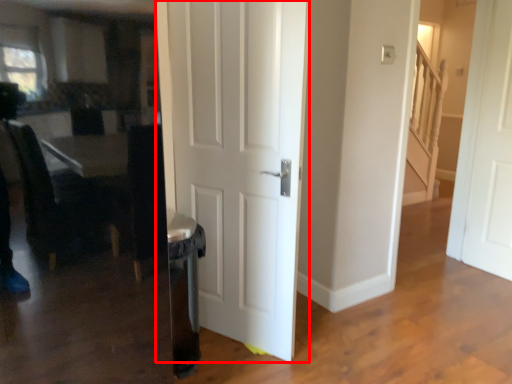
Question: Considering the relative positions of door (annotated by the red box) and door in the image provided, where is door (annotated by the red box) located with respect to the staircase?

Choices:
 (A) left
 (B) right

Answer: (A)